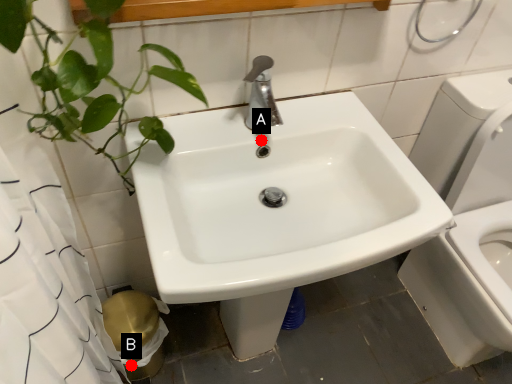
Question: Two points are circled on the image, labeled by A and B beside each circle. Which point is farther to the camera?

Choices:
 (A) A is further
 (B) B is further

Answer: (B)